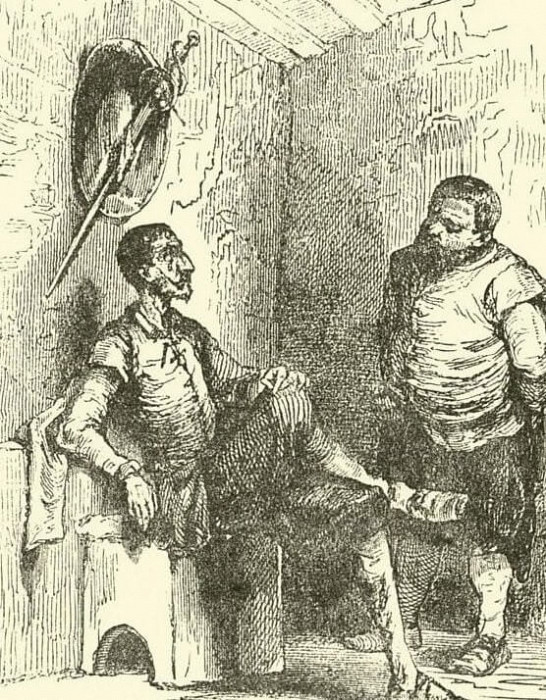
At what (x,y) coordinates should I click in order to perform the action: click on man sitting on stool. Please return your answer as a coordinate pair (x, y). This screenshot has height=700, width=546. Looking at the image, I should click on (189, 442).